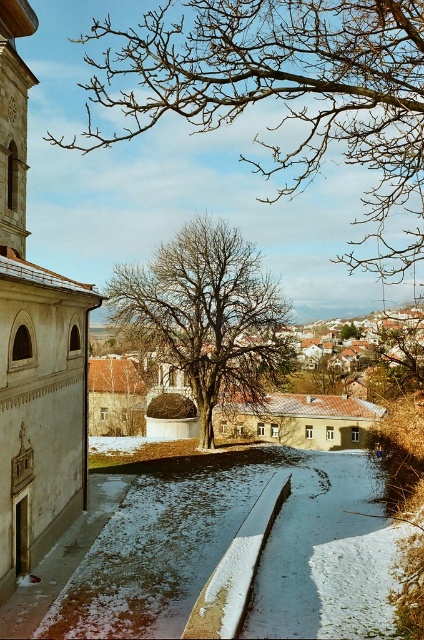
Looking at this image, can you confirm if white stone tower at left is taller than bare branches at center?

Indeed, white stone tower at left has a greater height compared to bare branches at center.

Describe the element at coordinates (35, 348) in the screenshot. I see `white stone tower at left` at that location.

Describe the element at coordinates (35, 348) in the screenshot. I see `white stone tower at left` at that location.

The height and width of the screenshot is (640, 424). In order to click on white stone tower at left in this screenshot , I will do `click(35, 348)`.

Which is above, bare branches at upper center or bare branches at center?

bare branches at upper center is higher up.

Does bare branches at upper center appear over bare branches at center?

Yes.

Which is behind, point (150, 36) or point (178, 348)?

The point (150, 36) is behind.

Identify the location of bare branches at upper center. (282, 93).

Can you confirm if white stone tower at left is positioned to the right of brown leafless tree at center?

In fact, white stone tower at left is to the left of brown leafless tree at center.

Looking at this image, can you confirm if white stone tower at left is positioned above brown leafless tree at center?

Yes, white stone tower at left is above brown leafless tree at center.

The height and width of the screenshot is (640, 424). What are the coordinates of `white stone tower at left` in the screenshot? It's located at (35, 348).